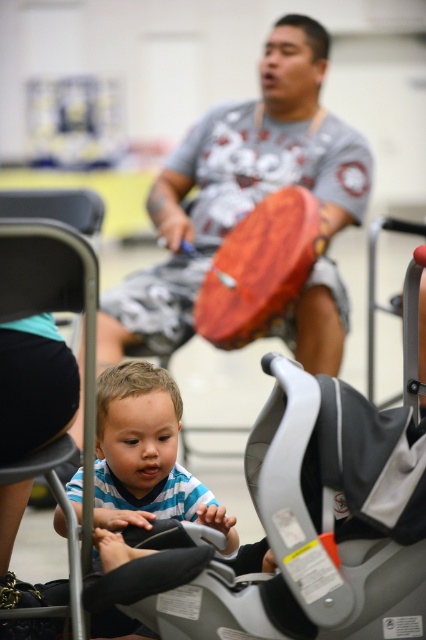
Question: Does gray plastic baby carriage at center have a greater width compared to gray cotton t-shirt at center?

Choices:
 (A) no
 (B) yes

Answer: (A)

Question: Which point is closer to the camera taking this photo?

Choices:
 (A) (52, 228)
 (B) (287, 449)

Answer: (A)

Question: Which point is farther to the camera?

Choices:
 (A) gray plastic baby carriage at center
 (B) black fabric chair at lower left
 (C) blue striped shirt at lower left

Answer: (C)

Question: Which object is positioned closest to the gray plastic baby carriage at center?

Choices:
 (A) gray cotton t-shirt at center
 (B) blue striped shirt at lower left

Answer: (B)

Question: Is blue striped shirt at lower left positioned behind black fabric chair at lower left?

Choices:
 (A) yes
 (B) no

Answer: (A)

Question: Does gray cotton t-shirt at center appear on the right side of blue striped shirt at lower left?

Choices:
 (A) no
 (B) yes

Answer: (B)